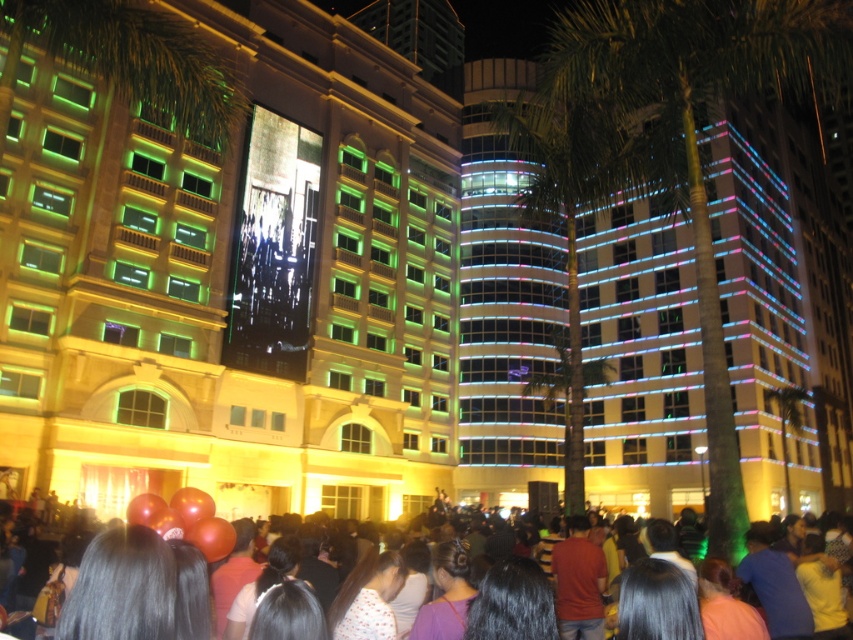
You are an event planner trying to decide where to place a new banner. You have two options for placement areas based on the existing structures in the scene. The first area is near the matte gold building at center, and the second is near the green leafy palm tree at right. Which area would allow for a larger banner due to the space occupied by the structures?

The green leafy palm tree at right occupies more space than the matte gold building at center, so placing the banner near the green leafy palm tree at right would allow for a larger banner since there is more space available.